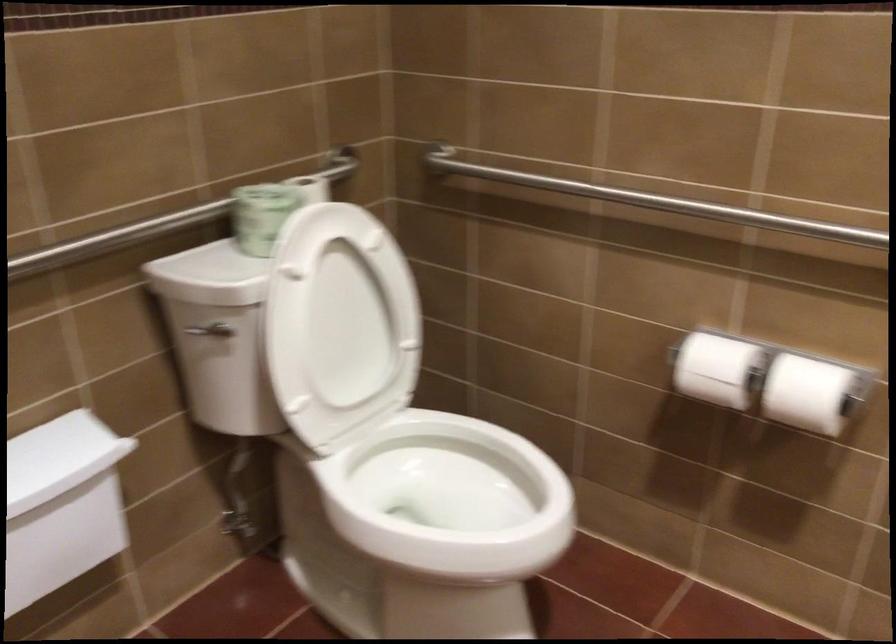
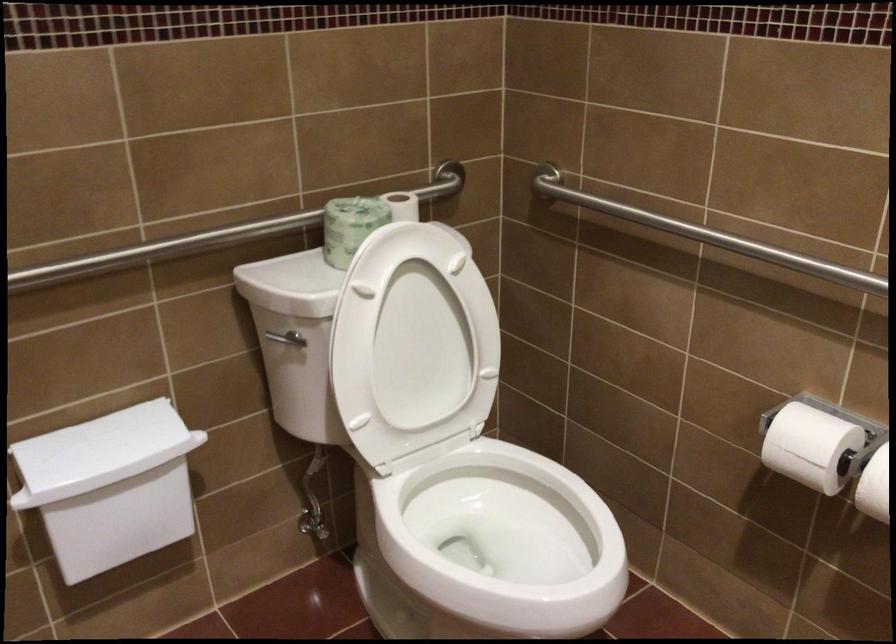
In the second image, find the point that corresponds to pixel 202 336 in the first image.

(281, 343)